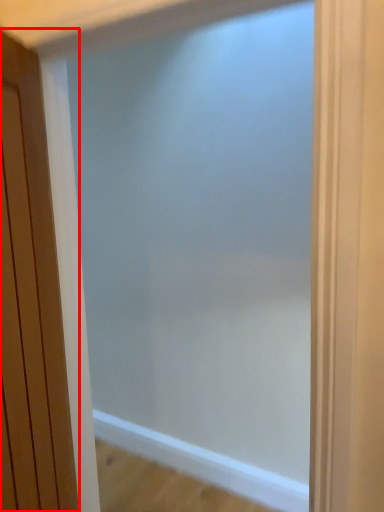
Question: In this image, where is door (annotated by the red box) located relative to screen door?

Choices:
 (A) left
 (B) right

Answer: (A)